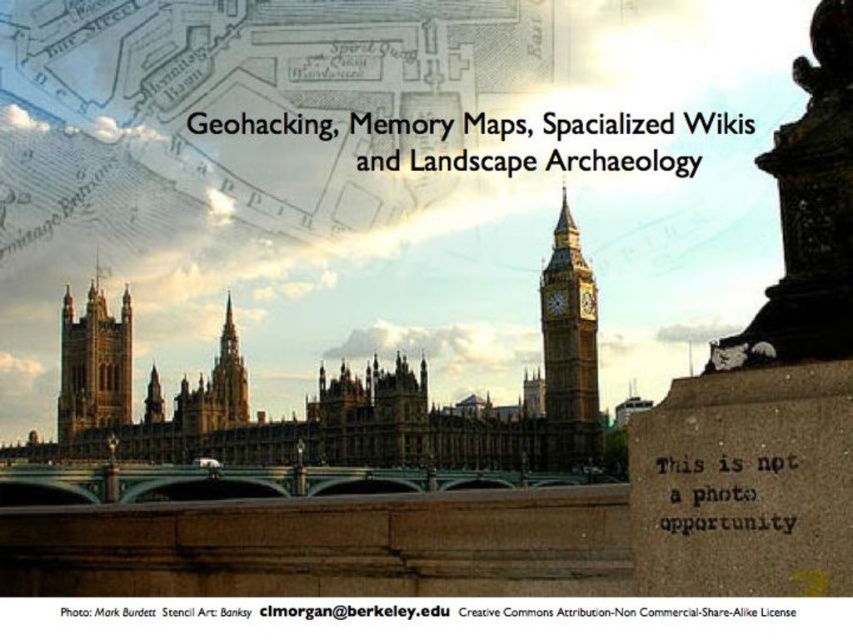
Question: Can you confirm if dark gray stone statue at upper right is positioned below red brick tower at left?

Choices:
 (A) no
 (B) yes

Answer: (A)

Question: Does dark gray stone statue at upper right lie behind matte gold clock at center?

Choices:
 (A) yes
 (B) no

Answer: (B)

Question: From the image, what is the correct spatial relationship of gold-plated clock tower at center-right in relation to red brick tower at left?

Choices:
 (A) above
 (B) below

Answer: (A)

Question: Which of the following is the farthest from the observer?

Choices:
 (A) dark gray stone statue at upper right
 (B) gold-plated clock tower at center-right
 (C) matte gold clock at center

Answer: (C)

Question: Which object is farther from the camera taking this photo?

Choices:
 (A) matte gold clock at center
 (B) dark gray stone statue at upper right

Answer: (A)

Question: Which object is closer to the camera taking this photo?

Choices:
 (A) dark gray stone statue at upper right
 (B) gold-plated clock tower at center-right
 (C) matte gold clock at center right

Answer: (A)